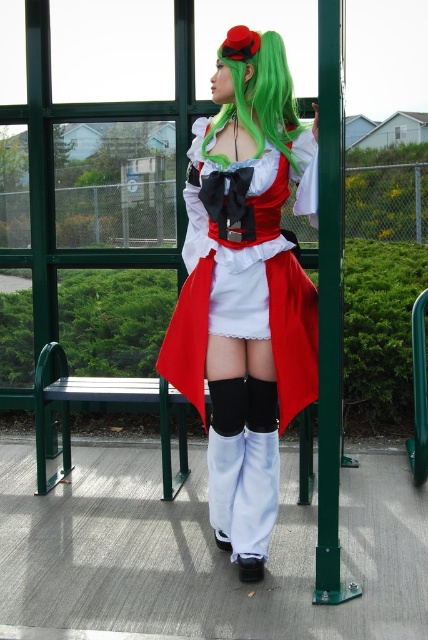
You are a photographer trying to capture the best shot of the person in the satin red coat at center and the green metal bench at left. Which object should you focus on first if you want to emphasize depth in the image?

You should focus on the green metal bench at left first because it is farther away from the viewer compared to the satin red coat at center, creating a sense of depth by having the closer object sharp and the background blurred.

What is the color of the clothing item located at the coordinates point (244, 291)?

The point (244, 291) corresponds to the satin red coat at center, so the color is red.

You are a photographer trying to capture the best angle of the person in the vibrant costume. You notice the green metal bench at left and the green silky wig at center. Which object is positioned lower in the image?

The green metal bench at left is located below the green silky wig at center, so the green metal bench at left is positioned lower in the image.